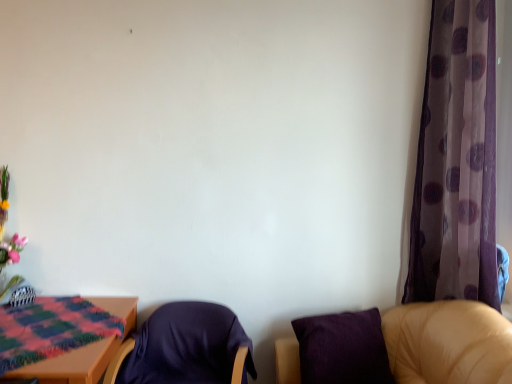
Identify the location of wooden table at lower left. The image size is (512, 384). (84, 351).

Image resolution: width=512 pixels, height=384 pixels. What do you see at coordinates (185, 348) in the screenshot?
I see `dark blue fabric chair at center, marked as the 1th chair in a left-to-right arrangement` at bounding box center [185, 348].

What do you see at coordinates (457, 161) in the screenshot? I see `transparent purple curtain at right` at bounding box center [457, 161].

What is the approximate width of transparent purple curtain at right?

transparent purple curtain at right is 7.48 inches wide.

The image size is (512, 384). Describe the element at coordinates (4, 225) in the screenshot. I see `matte ceramic vase at left` at that location.

This screenshot has width=512, height=384. Identify the location of wooden table at lower left. (84, 351).

The height and width of the screenshot is (384, 512). In the image, there is a purple fabric chair at lower right, the 1th chair from the right. Identify the location of chair below it (from a real-world perspective). (185, 348).

From a real-world perspective, is purple fabric chair at lower right, the 1th chair from the right, above or below dark blue fabric chair at center, marked as the 1th chair in a left-to-right arrangement?

From a real-world perspective, purple fabric chair at lower right, the 1th chair from the right, is physically above dark blue fabric chair at center, marked as the 1th chair in a left-to-right arrangement.

Considering the sizes of objects purple fabric chair at lower right, the 1th chair from the right, and dark blue fabric chair at center, which appears as the 2th chair when viewed from the right, in the image provided, who is wider, purple fabric chair at lower right, the 1th chair from the right, or dark blue fabric chair at center, which appears as the 2th chair when viewed from the right,?

purple fabric chair at lower right, the 1th chair from the right.

Consider the image. Considering the positions of objects purple fabric chair at lower right, the second chair viewed from the left, and dark blue fabric chair at center, which appears as the 2th chair when viewed from the right, in the image provided, who is behind, purple fabric chair at lower right, the second chair viewed from the left, or dark blue fabric chair at center, which appears as the 2th chair when viewed from the right,?

dark blue fabric chair at center, which appears as the 2th chair when viewed from the right, is further from the camera.

Is dark blue fabric chair at center, which appears as the 2th chair when viewed from the right, to the left of wooden table at lower left from the viewer's perspective?

No.

In the scene shown: Can you confirm if dark blue fabric chair at center, marked as the 1th chair in a left-to-right arrangement, is thinner than wooden table at lower left?

No.

Locate an element on the screen. table above the dark blue fabric chair at center, marked as the 1th chair in a left-to-right arrangement (from a real-world perspective) is located at coordinates (84, 351).

From the picture: From a real-world perspective, is dark blue fabric chair at center, which appears as the 2th chair when viewed from the right, physically located above or below wooden table at lower left?

dark blue fabric chair at center, which appears as the 2th chair when viewed from the right, is situated lower than wooden table at lower left in the real world.

Does matte ceramic vase at left contain purple fabric chair at lower right, the second chair viewed from the left?

Actually, purple fabric chair at lower right, the second chair viewed from the left, is outside matte ceramic vase at left.

The height and width of the screenshot is (384, 512). In order to click on the 2nd chair in front when counting from the matte ceramic vase at left in this screenshot , I will do `click(448, 343)`.

Measure the distance between matte ceramic vase at left and purple fabric chair at lower right, the second chair viewed from the left.

A distance of 1.88 meters exists between matte ceramic vase at left and purple fabric chair at lower right, the second chair viewed from the left.

Which chair is the 2nd one when counting from the front of the matte ceramic vase at left? Please provide its 2D coordinates.

[(448, 343)]

Is purple fabric chair at lower right, the second chair viewed from the left, bigger or smaller than matte ceramic vase at left?

In the image, purple fabric chair at lower right, the second chair viewed from the left, appears to be larger than matte ceramic vase at left.

From the image's perspective, does purple fabric chair at lower right, the 1th chair from the right, appear higher than matte ceramic vase at left?

Actually, purple fabric chair at lower right, the 1th chair from the right, appears below matte ceramic vase at left in the image.

How far apart are purple fabric chair at lower right, the second chair viewed from the left, and matte ceramic vase at left?

A distance of 6.18 feet exists between purple fabric chair at lower right, the second chair viewed from the left, and matte ceramic vase at left.

Considering the relative positions of dark blue fabric chair at center, marked as the 1th chair in a left-to-right arrangement, and purple fabric chair at lower right, the 1th chair from the right, in the image provided, is dark blue fabric chair at center, marked as the 1th chair in a left-to-right arrangement, to the right of purple fabric chair at lower right, the 1th chair from the right, from the viewer's perspective?

No, dark blue fabric chair at center, marked as the 1th chair in a left-to-right arrangement, is not to the right of purple fabric chair at lower right, the 1th chair from the right.

From the image's perspective, is dark blue fabric chair at center, which appears as the 2th chair when viewed from the right, below purple fabric chair at lower right, the second chair viewed from the left?

Yes, from the image's perspective, dark blue fabric chair at center, which appears as the 2th chair when viewed from the right, is beneath purple fabric chair at lower right, the second chair viewed from the left.

Is dark blue fabric chair at center, which appears as the 2th chair when viewed from the right, not within purple fabric chair at lower right, the 1th chair from the right?

That's correct, dark blue fabric chair at center, which appears as the 2th chair when viewed from the right, is outside of purple fabric chair at lower right, the 1th chair from the right.

Can you confirm if dark blue fabric chair at center, marked as the 1th chair in a left-to-right arrangement, is taller than purple fabric chair at lower right, the second chair viewed from the left?

No, dark blue fabric chair at center, marked as the 1th chair in a left-to-right arrangement, is not taller than purple fabric chair at lower right, the second chair viewed from the left.

Looking at this image, is matte ceramic vase at left surrounded by dark blue fabric chair at center, which appears as the 2th chair when viewed from the right?

No, matte ceramic vase at left is not inside dark blue fabric chair at center, which appears as the 2th chair when viewed from the right.

From the image's perspective, is dark blue fabric chair at center, which appears as the 2th chair when viewed from the right, beneath matte ceramic vase at left?

Yes.

Is dark blue fabric chair at center, marked as the 1th chair in a left-to-right arrangement, wider than matte ceramic vase at left?

Yes.

Can you confirm if dark blue fabric chair at center, which appears as the 2th chair when viewed from the right, is positioned to the right of matte ceramic vase at left?

Yes.

Considering the relative positions of wooden table at lower left and transparent purple curtain at right in the image provided, is wooden table at lower left to the left or to the right of transparent purple curtain at right?

wooden table at lower left is to the left of transparent purple curtain at right.

Is wooden table at lower left positioned with its back to transparent purple curtain at right?

No, wooden table at lower left's orientation is not away from transparent purple curtain at right.

Is point (90, 370) more distant than point (456, 230)?

No.

Identify the location of curtain located above the wooden table at lower left (from a real-world perspective). The width and height of the screenshot is (512, 384). (457, 161).

This screenshot has width=512, height=384. I want to click on chair behind the purple fabric chair at lower right, the 1th chair from the right, so click(185, 348).

Where is `chair that is the 2nd one when counting downward from the wooden table at lower left (from the image's perspective)`? The image size is (512, 384). chair that is the 2nd one when counting downward from the wooden table at lower left (from the image's perspective) is located at coordinates (185, 348).

Estimate the real-world distances between objects in this image. Which object is closer to dark blue fabric chair at center, which appears as the 2th chair when viewed from the right, purple fabric chair at lower right, the second chair viewed from the left, or matte ceramic vase at left?

matte ceramic vase at left.

Looking at this image, looking at the image, which one is located closer to purple fabric chair at lower right, the 1th chair from the right, matte ceramic vase at left or transparent purple curtain at right?

The object closer to purple fabric chair at lower right, the 1th chair from the right, is transparent purple curtain at right.

Which object lies nearer to the anchor point matte ceramic vase at left, dark blue fabric chair at center, which appears as the 2th chair when viewed from the right, or purple fabric chair at lower right, the second chair viewed from the left?

dark blue fabric chair at center, which appears as the 2th chair when viewed from the right, is positioned closer to the anchor matte ceramic vase at left.

When comparing their distances from wooden table at lower left, does transparent purple curtain at right or dark blue fabric chair at center, marked as the 1th chair in a left-to-right arrangement, seem further?

transparent purple curtain at right lies further to wooden table at lower left than the other object.

Based on their spatial positions, is matte ceramic vase at left or dark blue fabric chair at center, which appears as the 2th chair when viewed from the right, further from purple fabric chair at lower right, the second chair viewed from the left?

matte ceramic vase at left.

Considering their positions, is dark blue fabric chair at center, which appears as the 2th chair when viewed from the right, positioned closer to transparent purple curtain at right than wooden table at lower left?

dark blue fabric chair at center, which appears as the 2th chair when viewed from the right, lies closer to transparent purple curtain at right than the other object.

Estimate the real-world distances between objects in this image. Which object is closer to purple fabric chair at lower right, the second chair viewed from the left, matte ceramic vase at left or wooden table at lower left?

Among the two, wooden table at lower left is located nearer to purple fabric chair at lower right, the second chair viewed from the left.

When comparing their distances from wooden table at lower left, does dark blue fabric chair at center, which appears as the 2th chair when viewed from the right, or purple fabric chair at lower right, the second chair viewed from the left, seem further?

purple fabric chair at lower right, the second chair viewed from the left, lies further to wooden table at lower left than the other object.

The image size is (512, 384). Identify the location of table between matte ceramic vase at left and transparent purple curtain at right. (84, 351).

Where is `table between matte ceramic vase at left and dark blue fabric chair at center, marked as the 1th chair in a left-to-right arrangement`? This screenshot has width=512, height=384. table between matte ceramic vase at left and dark blue fabric chair at center, marked as the 1th chair in a left-to-right arrangement is located at coordinates (84, 351).

Locate an element on the screen. This screenshot has height=384, width=512. table between matte ceramic vase at left and purple fabric chair at lower right, the second chair viewed from the left is located at coordinates (84, 351).

This screenshot has width=512, height=384. In order to click on chair between dark blue fabric chair at center, marked as the 1th chair in a left-to-right arrangement, and transparent purple curtain at right in this screenshot , I will do `click(448, 343)`.